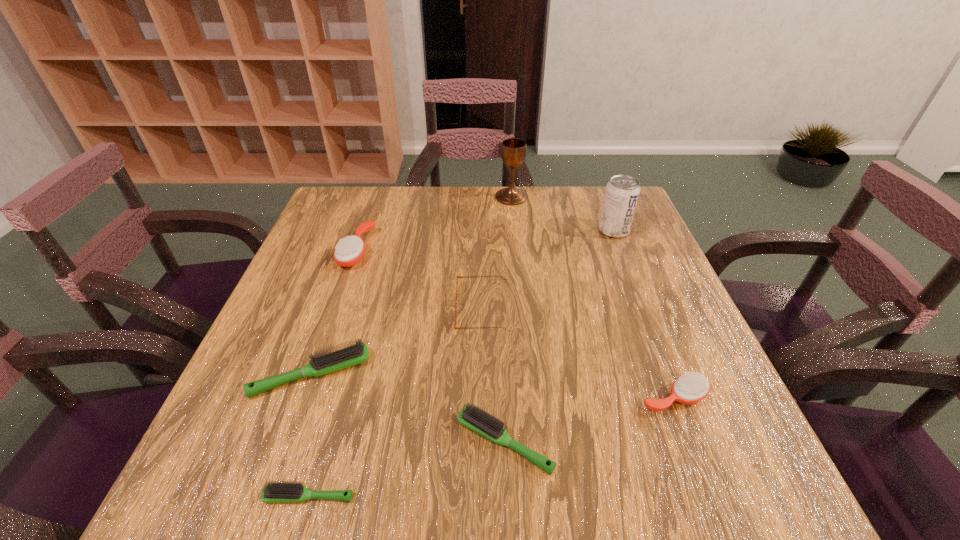
The image size is (960, 540). Find the location of `free spot between the seventh shortest object and the rightmost light hairbrush`. free spot between the seventh shortest object and the rightmost light hairbrush is located at coordinates (559, 336).

Identify the location of free spot between the second biggest light hairbrush and the shortest hairbrush. (407, 469).

I want to click on vacant area between the farthest light hairbrush and the farther orange hairbrush, so click(334, 312).

Identify the location of unoccupied area between the seventh shortest object and the sunglasses. Image resolution: width=960 pixels, height=540 pixels. [548, 269].

Find the location of `vacant area between the seventh shortest object and the right orange hairbrush`. vacant area between the seventh shortest object and the right orange hairbrush is located at coordinates (643, 314).

Find the location of a particular element. This screenshot has width=960, height=540. free point between the right orange hairbrush and the seventh shortest object is located at coordinates (643, 314).

Identify the location of object that stands as the closest to the soda can. This screenshot has width=960, height=540. (513, 151).

Identify the location of object that is the fourth closest one to the second nearest light hairbrush. tap(358, 353).

Image resolution: width=960 pixels, height=540 pixels. Identify the location of hairbrush that is the fourth closest to the right orange hairbrush. (348, 251).

This screenshot has height=540, width=960. I want to click on hairbrush that is the fifth closest to the farthest object, so click(x=278, y=491).